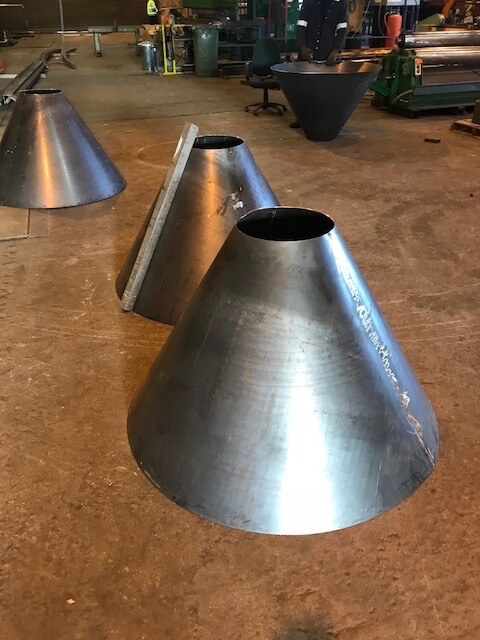
Where is `chair`? The height and width of the screenshot is (640, 480). chair is located at coordinates (263, 83).